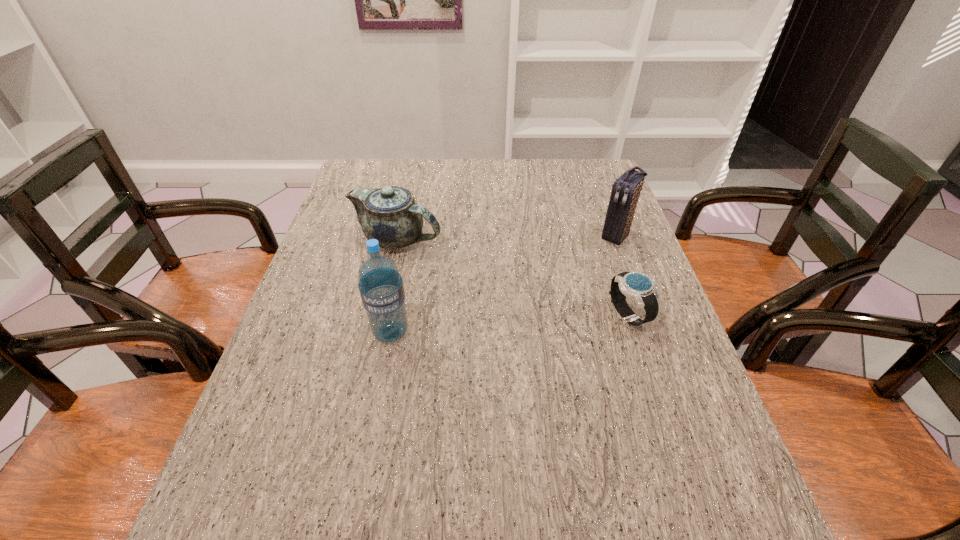
This screenshot has width=960, height=540. What are the coordinates of `free space on the desktop that is between the water bottle and the watch and is positioned with the zip open on the clutch bag` in the screenshot? It's located at (535, 322).

The height and width of the screenshot is (540, 960). What are the coordinates of `free space on the desktop that is between the tallest object and the shortest object and is positioned from the spout of the chinaware` in the screenshot? It's located at (533, 322).